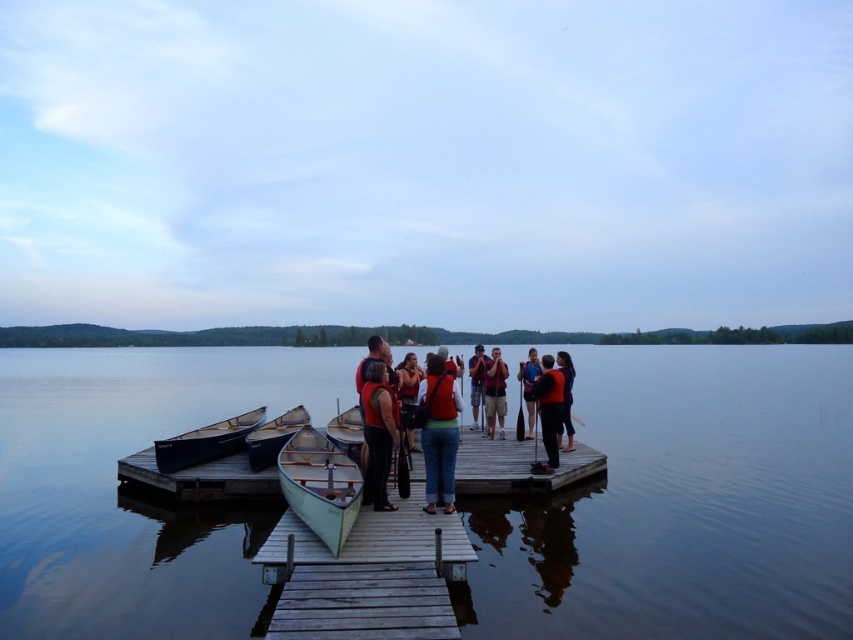
Question: Which object appears closest to the camera in this image?

Choices:
 (A) matte black camera at center
 (B) light green wood canoe at center

Answer: (B)

Question: Does light green wood canoe at center appear over matte brown life vest at center?

Choices:
 (A) yes
 (B) no

Answer: (B)

Question: Based on their relative distances, which object is farther from the matte black jacket at center?

Choices:
 (A) light green wood canoe at center
 (B) matte brown life vest at center
 (C) light green wooden canoe at center

Answer: (A)

Question: Which point is closer to the camera taking this photo?

Choices:
 (A) (173, 445)
 (B) (155, 474)

Answer: (B)

Question: Does denim jacket at center have a greater width compared to blue fabric shirt at center?

Choices:
 (A) yes
 (B) no

Answer: (A)

Question: Is the position of smooth water at dock center more distant than that of light green wooden canoe at center?

Choices:
 (A) no
 (B) yes

Answer: (B)